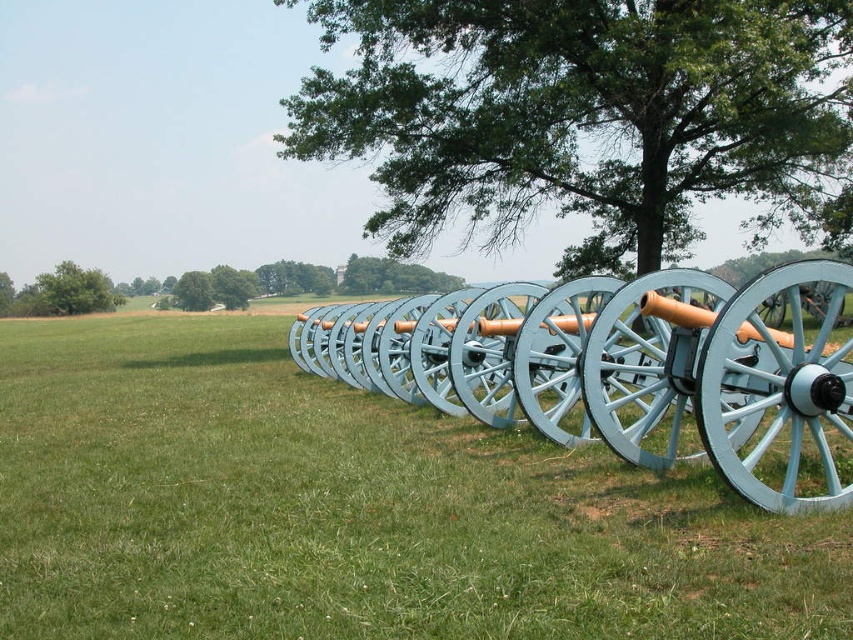
Question: Which object is the farthest from the light blue wood cannon at center?

Choices:
 (A) light blue wooden cannon at center
 (B) green leafy tree at upper center
 (C) green leafy tree at upper left

Answer: (C)

Question: Is light blue wooden cannon at center to the right of green leafy tree at upper left from the viewer's perspective?

Choices:
 (A) yes
 (B) no

Answer: (A)

Question: Can you confirm if light blue wood cannon at center is positioned above green leafy tree at upper left?

Choices:
 (A) yes
 (B) no

Answer: (B)

Question: Which object is farther from the camera taking this photo?

Choices:
 (A) green leafy tree at upper center
 (B) green leafy tree at upper left

Answer: (B)

Question: Which object is the farthest from the light blue wood cannon at center?

Choices:
 (A) green leafy tree at upper center
 (B) green leafy tree at upper left
 (C) light blue wooden cannon at center

Answer: (B)

Question: Does light blue wood cannon at center appear on the left side of light blue wooden cannon at center?

Choices:
 (A) no
 (B) yes

Answer: (B)